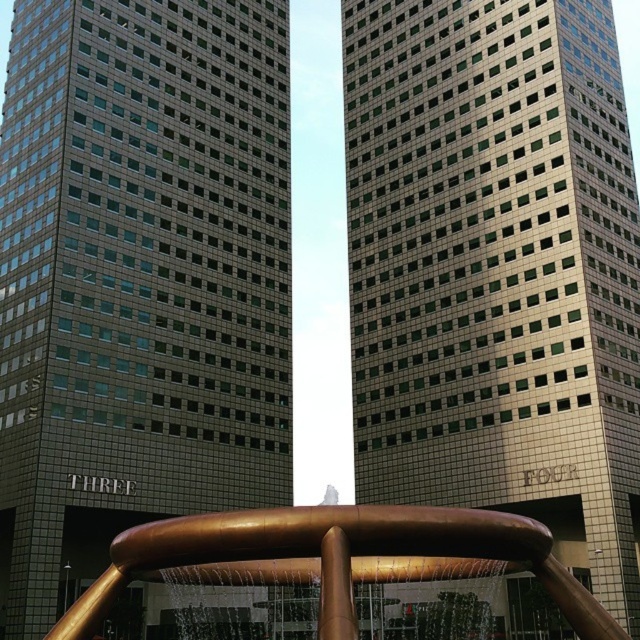
Question: Which point is closer to the camera taking this photo?

Choices:
 (A) (556, 134)
 (B) (4, 412)
 (C) (161, 540)

Answer: (C)

Question: Considering the real-world distances, which object is closest to the matte gray building at center?

Choices:
 (A) satin gold glass tower at center
 (B) gold polished water at center

Answer: (A)

Question: Is matte gray building at center bigger than gold polished water at center?

Choices:
 (A) no
 (B) yes

Answer: (B)

Question: Is satin gold glass tower at center thinner than gold polished water at center?

Choices:
 (A) no
 (B) yes

Answer: (A)

Question: Which point appears closest to the camera in this image?

Choices:
 (A) (36, 588)
 (B) (300, 580)
 (C) (545, 28)

Answer: (B)

Question: In this image, where is matte gray building at center located relative to satin gold glass tower at center?

Choices:
 (A) right
 (B) left

Answer: (B)